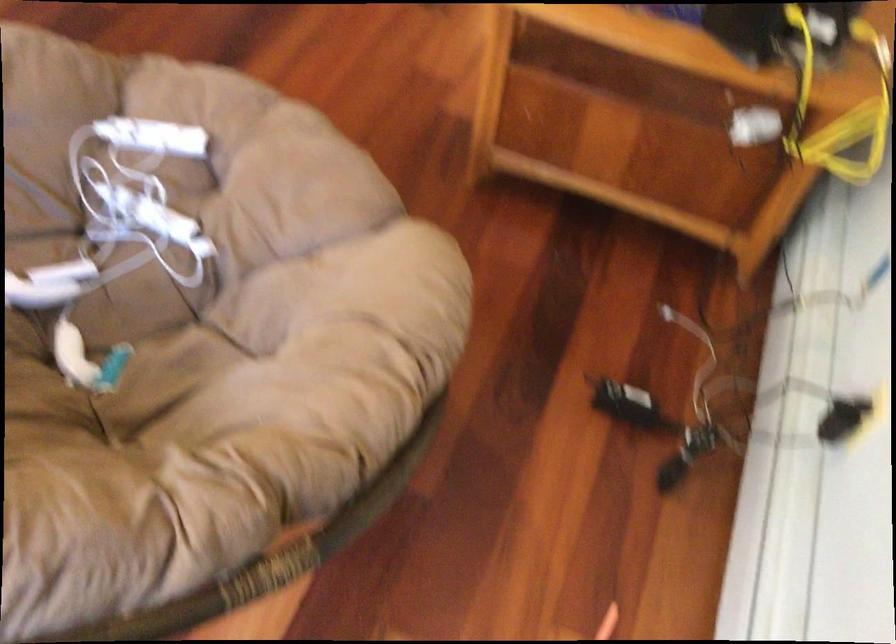
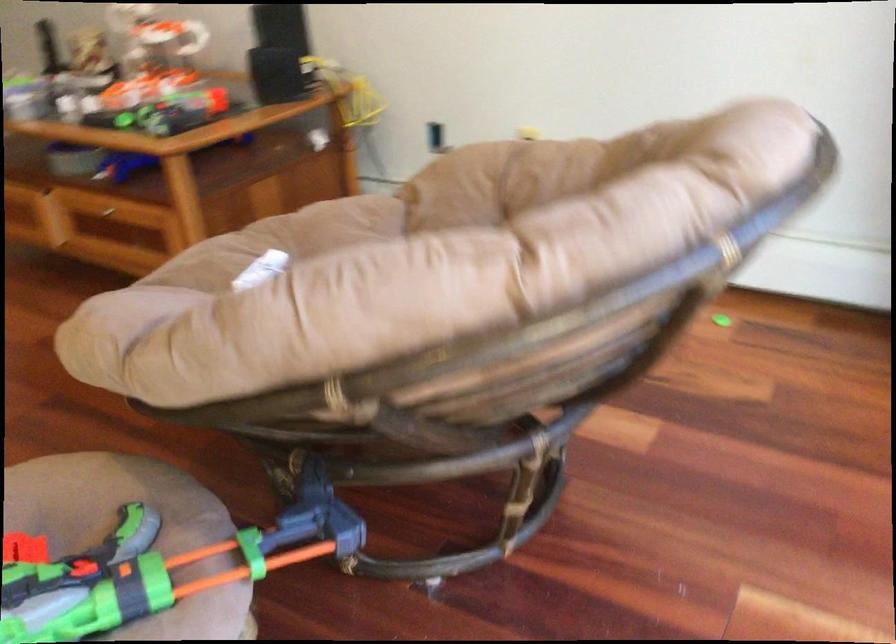
Question: I am providing you with two images of the same scene from different viewpoints. After the viewpoint changes to image2, which objects are now occluded?

Choices:
 (A) brown chair sitting surface
 (B) drawer handle
 (C) floral print tumbler
 (D) toy gun handle

Answer: (A)